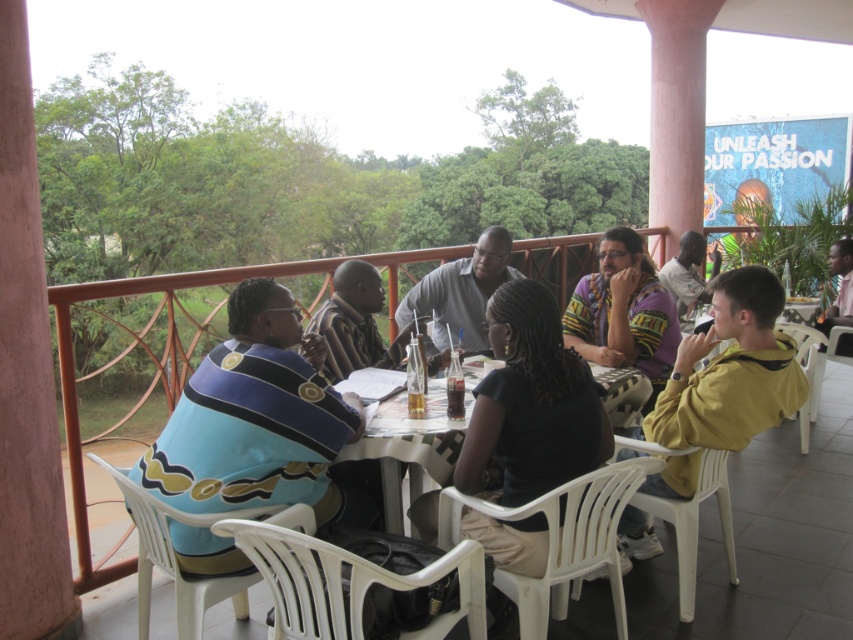
Measure the distance from white plastic table at center to light gray shirt at center.

24.55 inches

Looking at this image, who is more forward, (440, 388) or (440, 285)?

Point (440, 388) is in front.

Identify the location of white plastic table at center. This screenshot has height=640, width=853. (412, 445).

Does blue striped sweater at left have a larger size compared to matte black shirt at upper right?

Correct, blue striped sweater at left is larger in size than matte black shirt at upper right.

Between blue striped sweater at left and matte black shirt at upper right, which one has more height?

blue striped sweater at left

Is point (271, 314) positioned behind point (691, 269)?

No, (271, 314) is in front of (691, 269).

You are a GUI agent. You are given a task and a screenshot of the screen. Output one action in this format:
    pyautogui.click(x=<x>, y=<y>)
    Task: Click on the blue striped sweater at left
    Image resolution: width=853 pixels, height=640 pixels.
    Given the screenshot: What is the action you would take?
    pyautogui.click(x=254, y=417)

Can you confirm if blue striped sweater at left is wider than pink shirt at upper right?

Correct, the width of blue striped sweater at left exceeds that of pink shirt at upper right.

Describe the element at coordinates (254, 417) in the screenshot. I see `blue striped sweater at left` at that location.

Locate an element on the screen. The width and height of the screenshot is (853, 640). blue striped sweater at left is located at coordinates (254, 417).